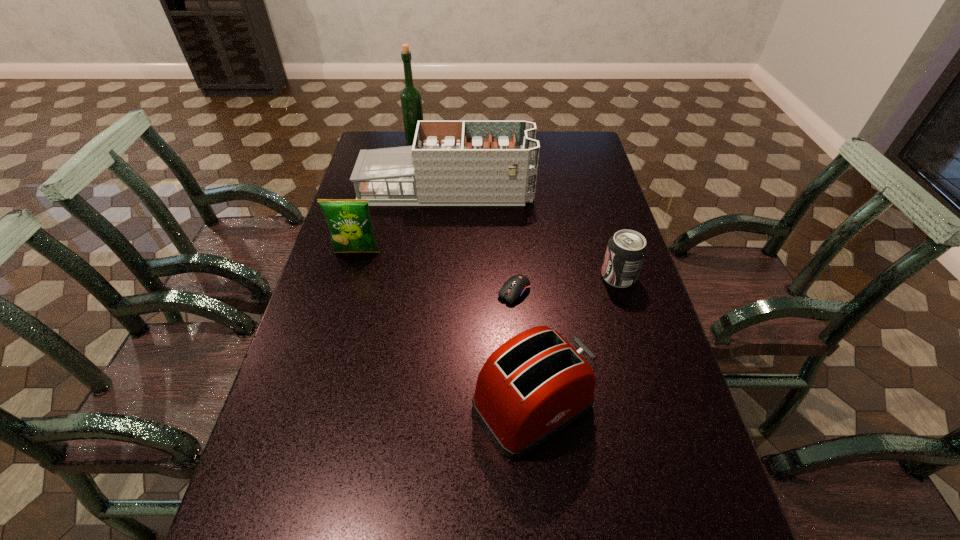
Locate an element on the screen. This screenshot has width=960, height=540. vacant space at the right edge is located at coordinates (586, 169).

The width and height of the screenshot is (960, 540). I want to click on vacant space at the far left corner, so click(x=381, y=146).

What are the coordinates of `vacant space at the far right corner` in the screenshot? It's located at (559, 139).

The image size is (960, 540). I want to click on free spot between the second shortest object and the third farthest object, so click(488, 264).

Find the location of a particular element. The height and width of the screenshot is (540, 960). vacant area between the fifth tallest object and the crisp (potato chip) is located at coordinates (488, 264).

This screenshot has width=960, height=540. Identify the location of free point between the nearest object and the dollhouse. (490, 298).

In order to click on empty location between the liquor and the shortest object in this screenshot , I will do `click(465, 218)`.

At what (x,y) coordinates should I click in order to perform the action: click on vacant point located between the soda can and the shortest object. Please return your answer as a coordinate pair (x, y). The width and height of the screenshot is (960, 540). Looking at the image, I should click on (566, 284).

Where is `vacant space that's between the shortest object and the crisp (potato chip)`? The width and height of the screenshot is (960, 540). vacant space that's between the shortest object and the crisp (potato chip) is located at coordinates (436, 272).

This screenshot has width=960, height=540. Identify the location of vacant area that lies between the second farthest object and the toaster. (490, 298).